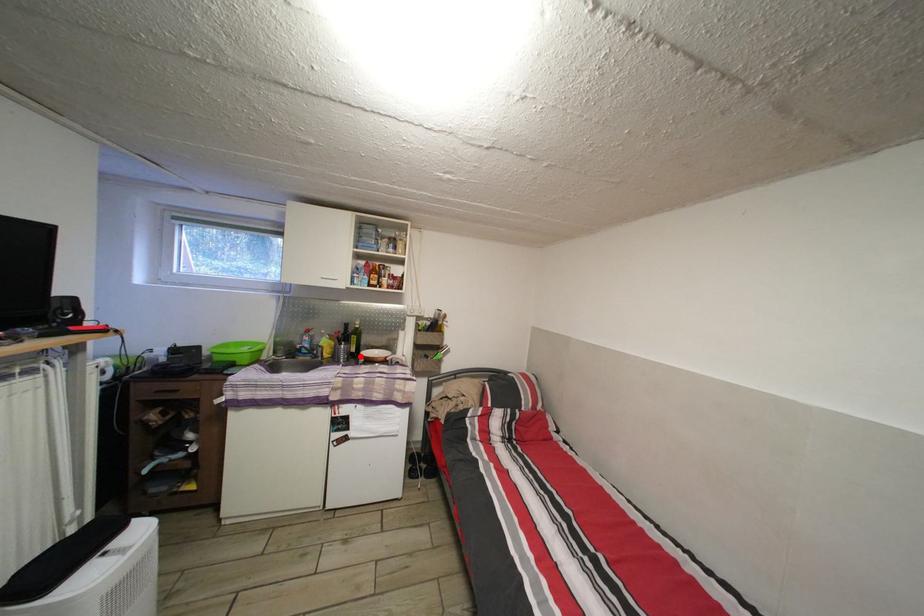
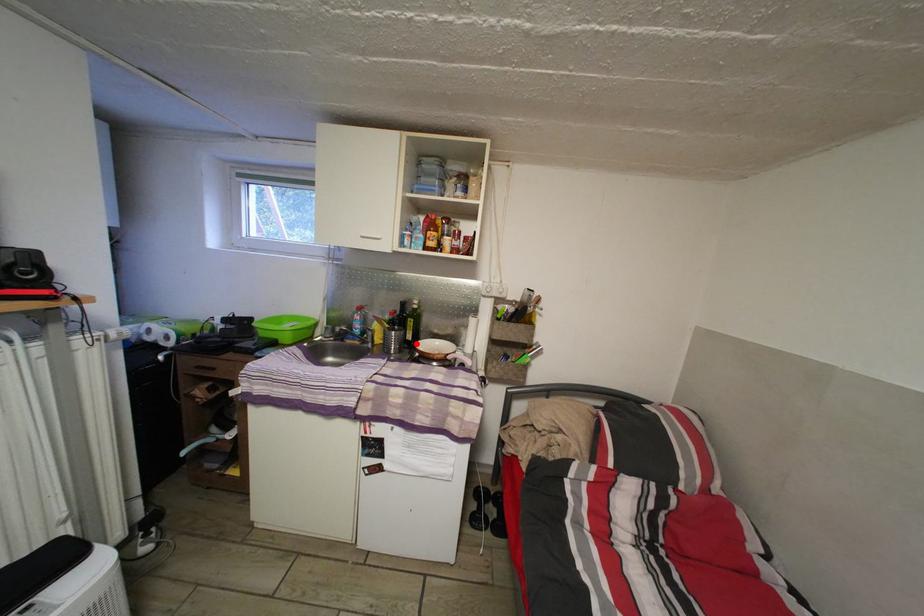
I am providing you with two images of the same scene from different viewpoints. A red point is marked on the first image and another point is marked on the second image. Do the highlighted points in image1 and image2 indicate the same real-world spot?

Yes